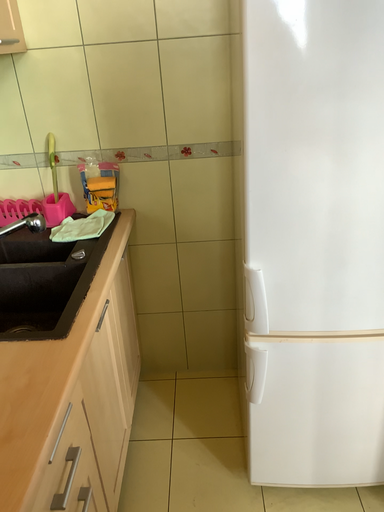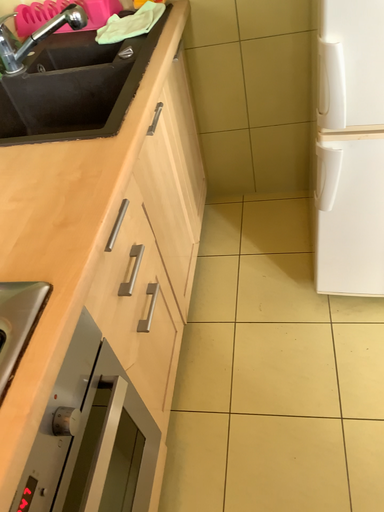
Question: How did the camera likely rotate when shooting the video?

Choices:
 (A) rotated right
 (B) rotated left

Answer: (B)